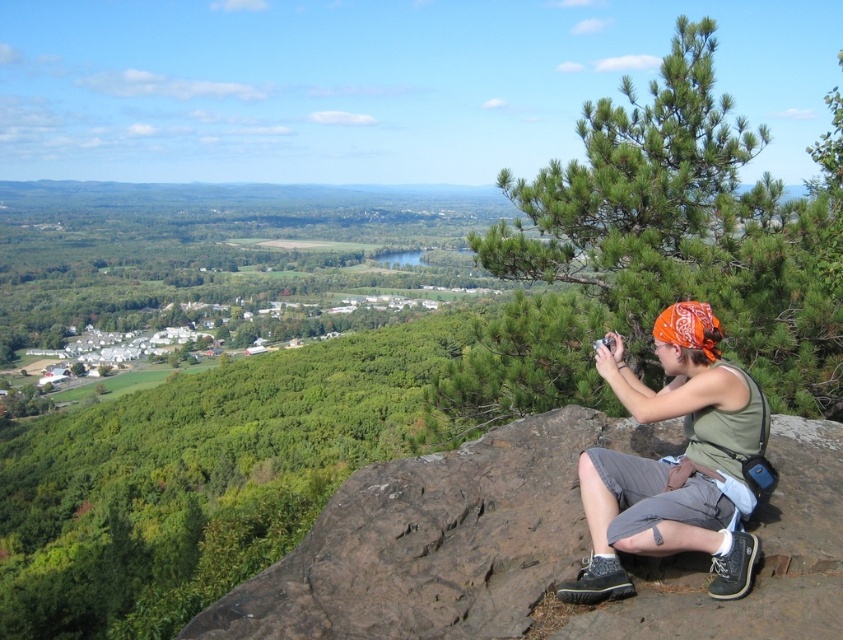
Between brown rough rock at center and green fabric tank top at center, which one is positioned lower?

brown rough rock at center is below.

Who is shorter, brown rough rock at center or green fabric tank top at center?

Standing shorter between the two is brown rough rock at center.

Does point (361, 588) come farther from viewer compared to point (726, 580)?

Yes, it is.

I want to click on brown rough rock at center, so click(x=438, y=540).